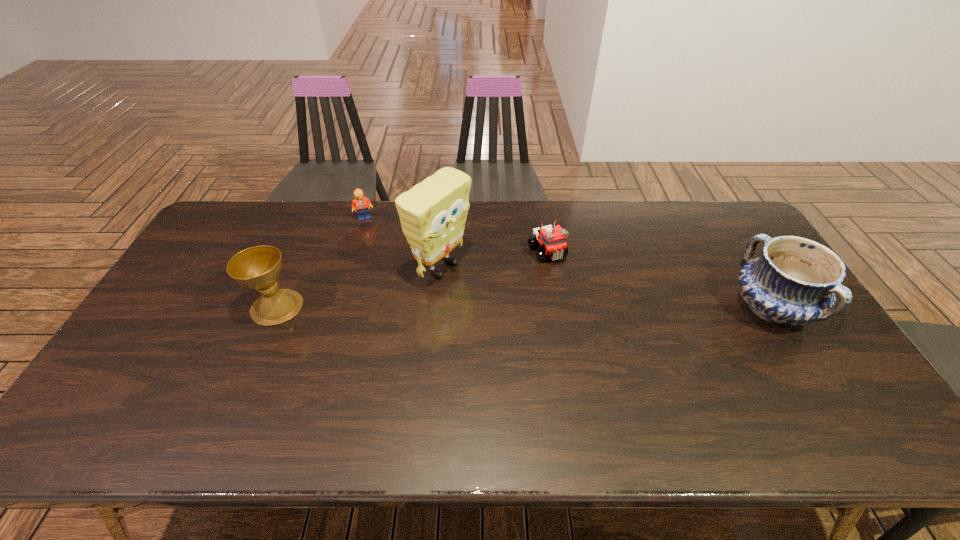
Locate an element on the screen. free spot on the desktop that is between the leftmost object and the rightmost object and is positioned on the face of the sponge is located at coordinates (514, 308).

Locate an element on the screen. Image resolution: width=960 pixels, height=540 pixels. free space on the desktop that is between the chalice and the pottery and is positioned on the front-facing side of the nearer Lego is located at coordinates (588, 308).

I want to click on free space on the desktop that is between the leftmost object and the rightmost object and is positioned on the front-facing side of the fourth object from right to left, so click(x=451, y=308).